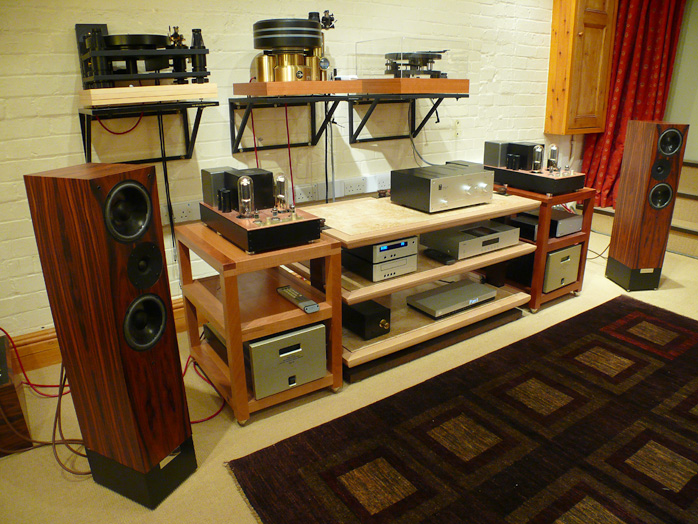
This screenshot has height=524, width=698. In order to click on carpet in this screenshot , I will do `click(447, 403)`.